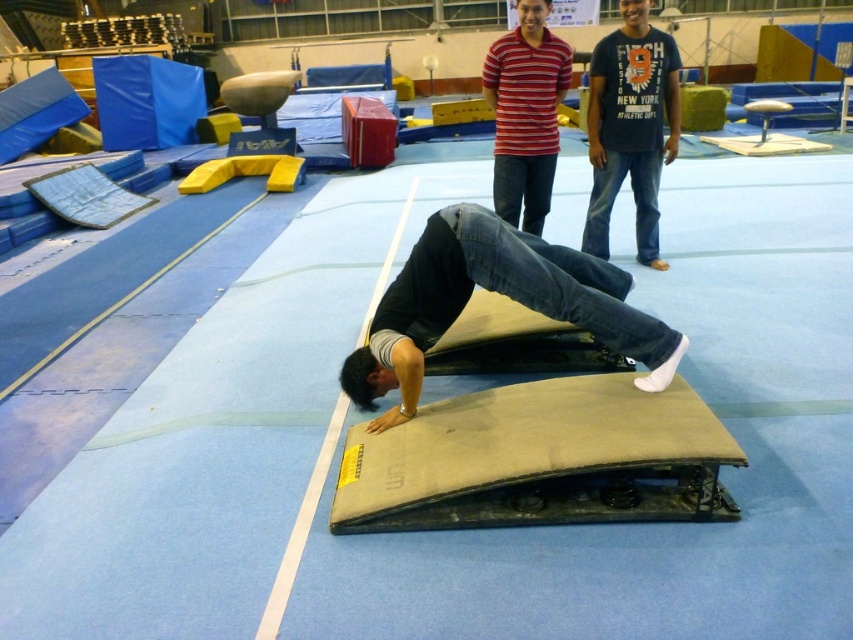
Question: Which of these objects is positioned farthest from the striped cotton shirt at upper center?

Choices:
 (A) dark blue t-shirt at upper right
 (B) denim jeans at center

Answer: (B)

Question: Is denim jeans at center wider than striped cotton shirt at upper center?

Choices:
 (A) yes
 (B) no

Answer: (A)

Question: Which object appears closest to the camera in this image?

Choices:
 (A) denim jeans at center
 (B) dark blue t-shirt at upper right
 (C) striped cotton shirt at upper center

Answer: (A)

Question: Is dark blue t-shirt at upper right positioned behind striped cotton shirt at upper center?

Choices:
 (A) no
 (B) yes

Answer: (B)

Question: Does denim jeans at center come in front of dark blue t-shirt at upper right?

Choices:
 (A) no
 (B) yes

Answer: (B)

Question: Which point is closer to the camera taking this photo?

Choices:
 (A) (630, 308)
 (B) (611, 64)
 (C) (524, 52)

Answer: (A)